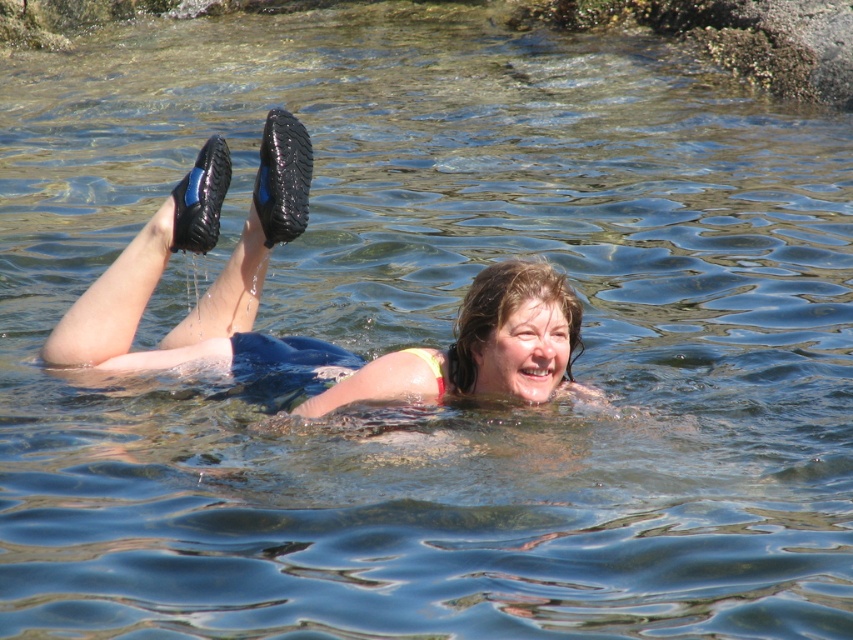
Is matte black shoes at center smaller than black rubber boot at upper left?

No, matte black shoes at center is not smaller than black rubber boot at upper left.

Describe the element at coordinates (323, 340) in the screenshot. Image resolution: width=853 pixels, height=640 pixels. I see `matte black shoes at center` at that location.

I want to click on matte black shoes at center, so click(x=323, y=340).

Is point (259, 202) positioned after point (177, 212)?

Yes.

From the picture: Measure the distance between rubber/soft-soled shoe at upper center and camera.

The distance of rubber/soft-soled shoe at upper center from camera is 5.83 meters.

Does point (277, 172) come farther from viewer compared to point (202, 209)?

Yes, point (277, 172) is behind point (202, 209).

This screenshot has width=853, height=640. I want to click on rubber/soft-soled shoe at upper center, so click(282, 177).

Can you confirm if matte black shoes at center is shorter than rubber/soft-soled shoe at upper center?

Incorrect, matte black shoes at center's height does not fall short of rubber/soft-soled shoe at upper center's.

What do you see at coordinates (323, 340) in the screenshot?
I see `matte black shoes at center` at bounding box center [323, 340].

Where is `matte black shoes at center`? matte black shoes at center is located at coordinates (323, 340).